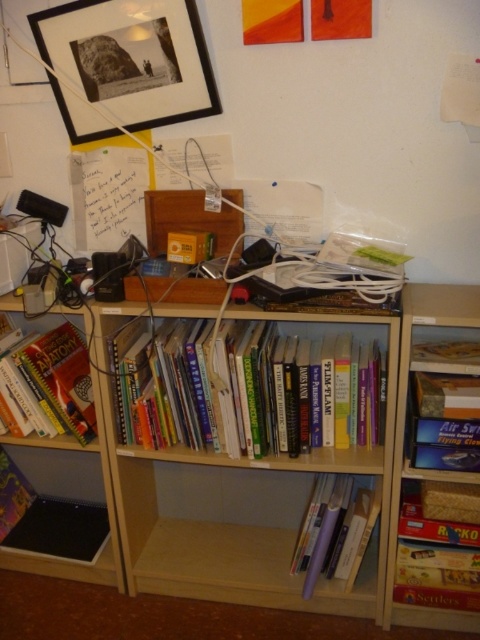
Does wooden board game at right have a smaller size compared to hardcover book at center-left?

No.

Does point (475, 314) lie behind point (37, 371)?

No, (475, 314) is closer to viewer.

Image resolution: width=480 pixels, height=640 pixels. Find the location of `wooden board game at right`. wooden board game at right is located at coordinates [x=404, y=429].

Where is `wooden board game at right`? Image resolution: width=480 pixels, height=640 pixels. wooden board game at right is located at coordinates (404, 429).

Is wooden board game at right below wooden board game at lower right?

No.

Which is behind, point (476, 301) or point (457, 531)?

The point (457, 531) is behind.

I want to click on wooden board game at right, so click(x=404, y=429).

Is blue cardboard game at right smaller than hardcover book at center-left?

Yes.

Does point (424, 352) lie in front of point (71, 426)?

Yes.

Find the location of a particular element. The image size is (480, 640). blue cardboard game at right is located at coordinates (444, 406).